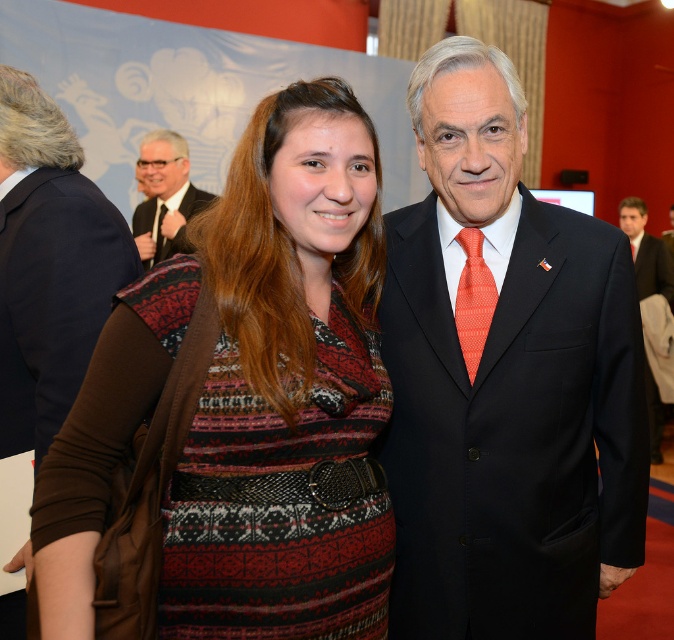
Question: Where is knitted sweater at center located in relation to matte black suit at center in the image?

Choices:
 (A) left
 (B) right

Answer: (A)

Question: Can you confirm if orange textured tie at center is positioned below dark blue suit at center?

Choices:
 (A) yes
 (B) no

Answer: (A)

Question: Which point is farther from the camera taking this photo?

Choices:
 (A) (162, 211)
 (B) (474, 321)
 (C) (644, 273)
 (D) (625, 230)

Answer: (D)

Question: Where is orange textured tie at center located in relation to matte black tie at center in the image?

Choices:
 (A) left
 (B) right

Answer: (B)

Question: Which point appears farthest from the camera in this image?

Choices:
 (A) (545, 300)
 (B) (381, 406)

Answer: (A)

Question: Which of the following is the closest to the observer?

Choices:
 (A) (648, 280)
 (B) (164, 205)
 (C) (410, 628)

Answer: (C)